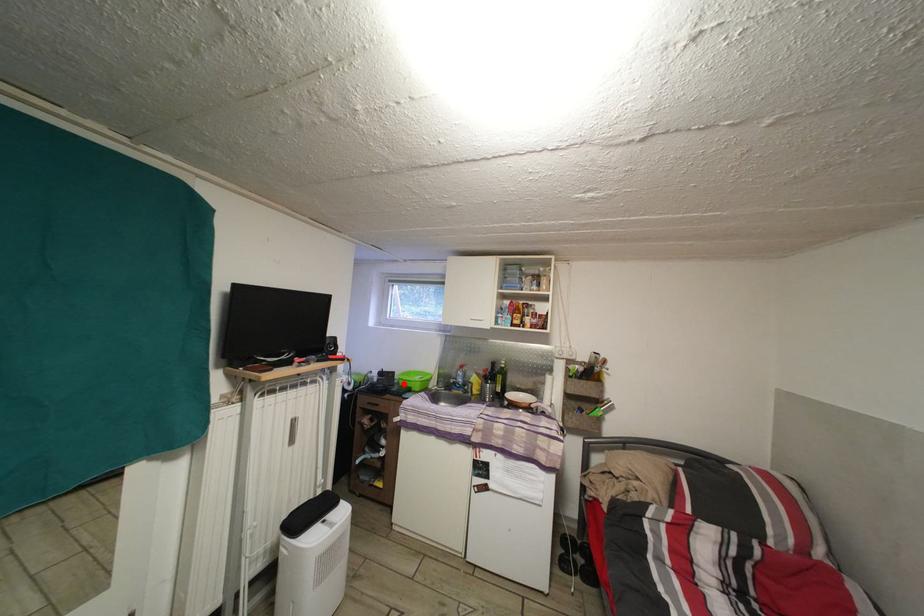
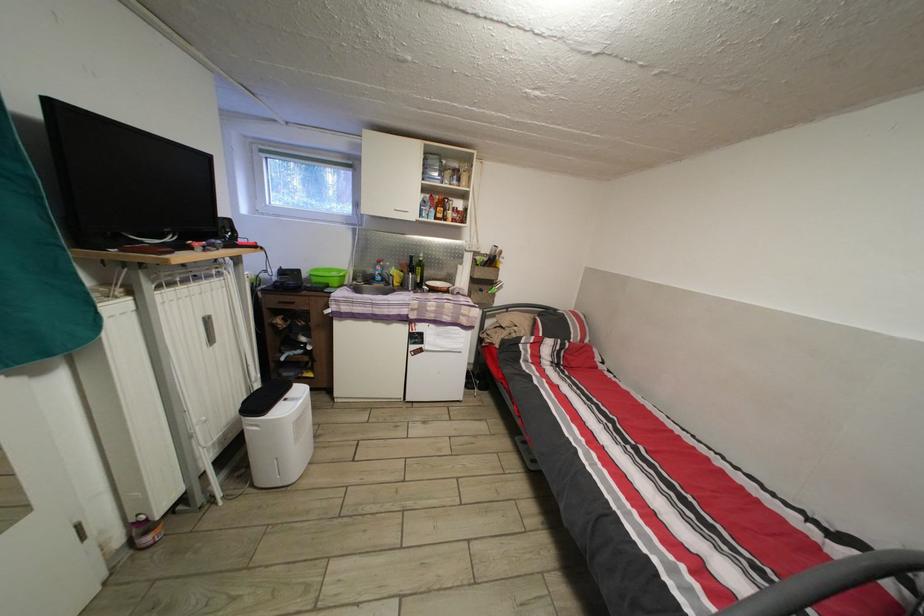
Question: I am providing you with two images of the same scene from different viewpoints. Image1 has a red point marked. In image2, the corresponding 3D location appears at what relative position? Reply with the corresponding letter.

Choices:
 (A) Closer
 (B) Farther

Answer: (A)